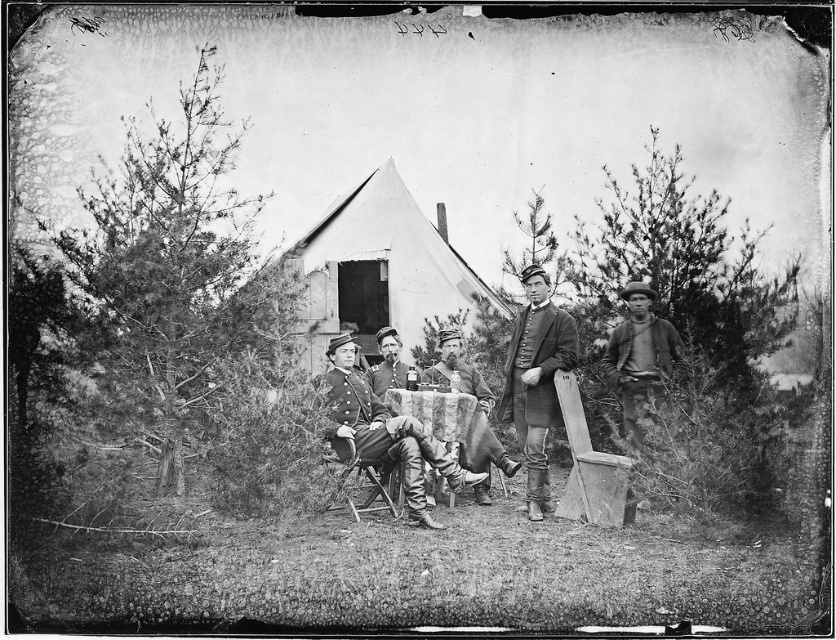
Question: Is uniformed men at center to the right of rugged brown shirt at right from the viewer's perspective?

Choices:
 (A) no
 (B) yes

Answer: (A)

Question: Does matte gray uniform at center appear over smooth leather hat at center?

Choices:
 (A) no
 (B) yes

Answer: (A)

Question: Which of the following is the closest to the observer?

Choices:
 (A) (507, 388)
 (B) (358, 428)

Answer: (B)

Question: Considering the real-world distances, which object is closest to the rugged brown shirt at right?

Choices:
 (A) white canvas tent at center
 (B) rustic wood chair at center
 (C) uniformed men at center

Answer: (C)

Question: Does uniformed soldier at center appear over rugged brown shirt at right?

Choices:
 (A) no
 (B) yes

Answer: (A)

Question: Which is nearer to the white canvas tent at center?

Choices:
 (A) smooth leather hat at center
 (B) rustic wood chair at center
 (C) matte gray uniform at center
 (D) uniformed soldier at center

Answer: (A)